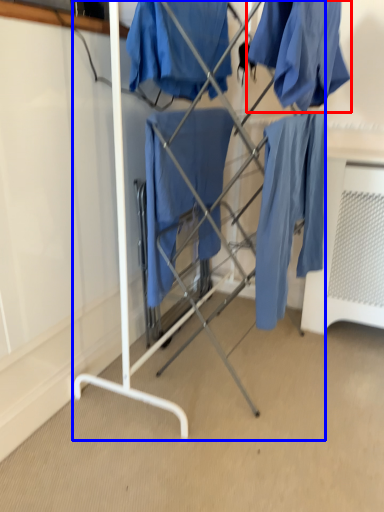
Question: Which object is further to the camera taking this photo, clothing (highlighted by a red box) or furniture (highlighted by a blue box)?

Choices:
 (A) clothing
 (B) furniture

Answer: (B)